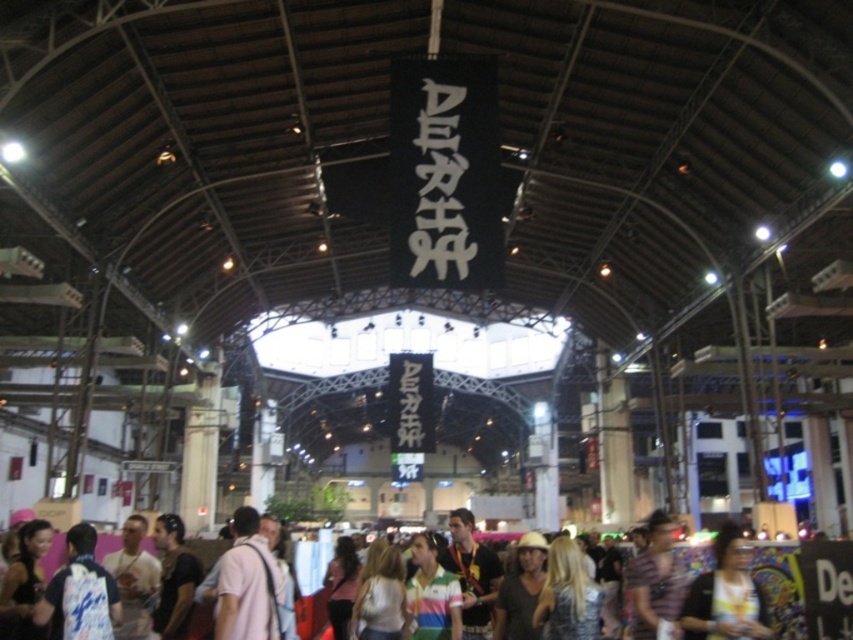
Is white t-shirt at center to the right of pink fabric at center from the viewer's perspective?

Indeed, white t-shirt at center is positioned on the right side of pink fabric at center.

Find the location of a particular element. The height and width of the screenshot is (640, 853). white t-shirt at center is located at coordinates (248, 586).

You are a GUI agent. You are given a task and a screenshot of the screen. Output one action in this format:
    pyautogui.click(x=<x>, y=<y>)
    Task: Click on the pink fabric at center
    The width and height of the screenshot is (853, 640).
    Given the screenshot: What is the action you would take?
    coord(247,582)

Does pink fabric at center have a lesser height compared to matte black jacket at lower right?

Yes, pink fabric at center is shorter than matte black jacket at lower right.

Which is behind, point (244, 520) or point (746, 561)?

Positioned behind is point (244, 520).

Locate an element on the screen. pink fabric at center is located at coordinates click(x=247, y=582).

Is point (757, 595) positioned after point (730, 632)?

Yes.

The image size is (853, 640). What do you see at coordinates (248, 586) in the screenshot? I see `white t-shirt at center` at bounding box center [248, 586].

Find the location of a particular element. white t-shirt at center is located at coordinates (248, 586).